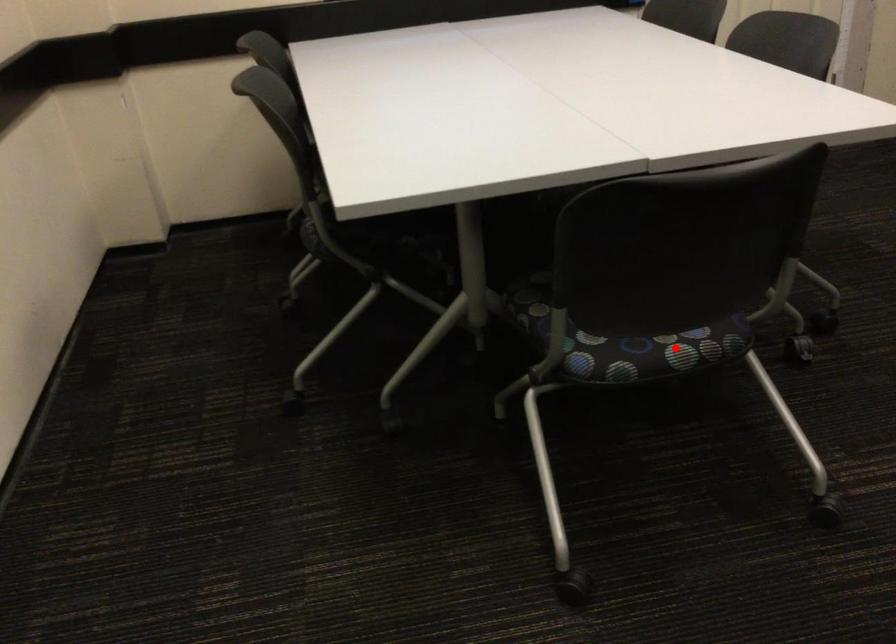
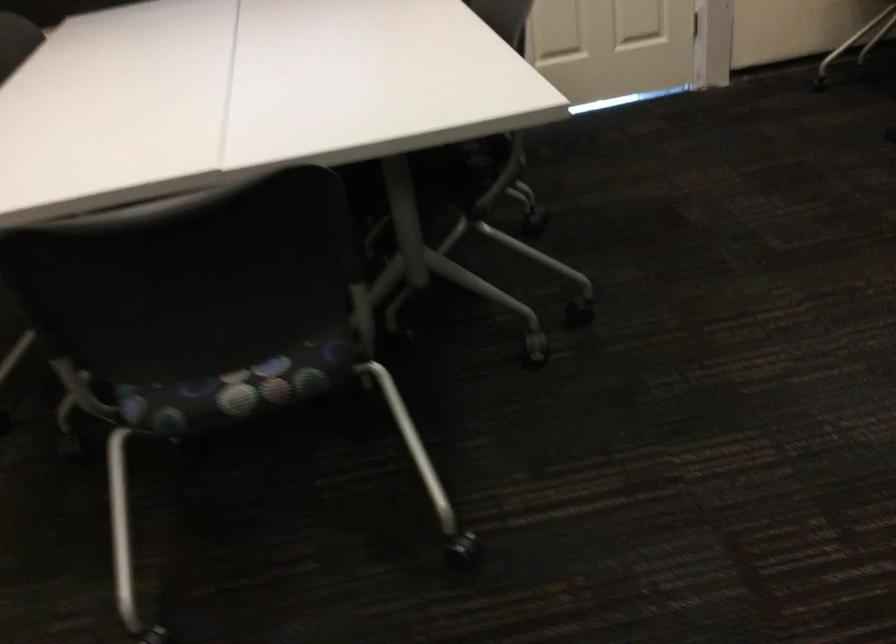
Question: I am providing you with two images of the same scene from different viewpoints. A red point is shown in image1. For the corresponding object point in image2, is it positioned nearer or farther from the camera?

Choices:
 (A) Nearer
 (B) Farther

Answer: (A)